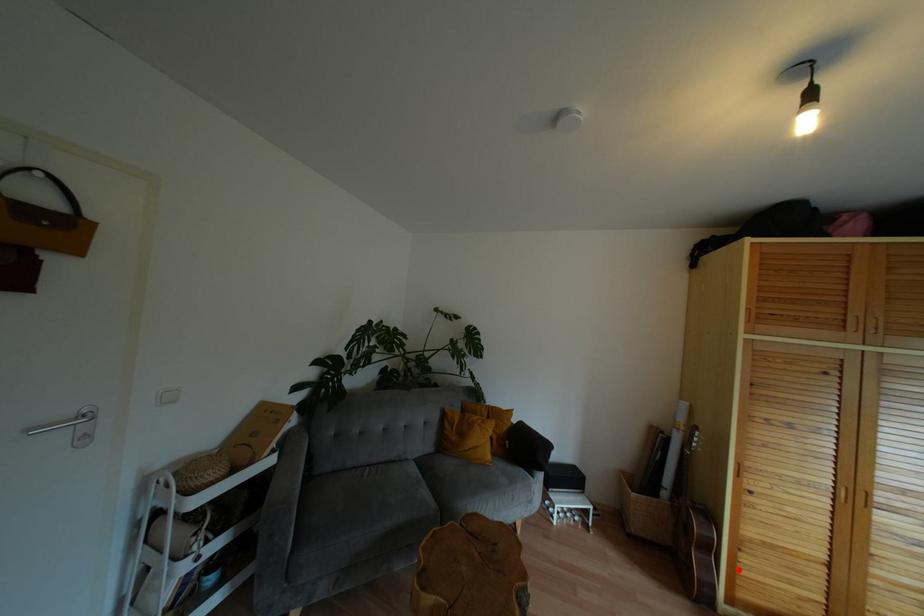
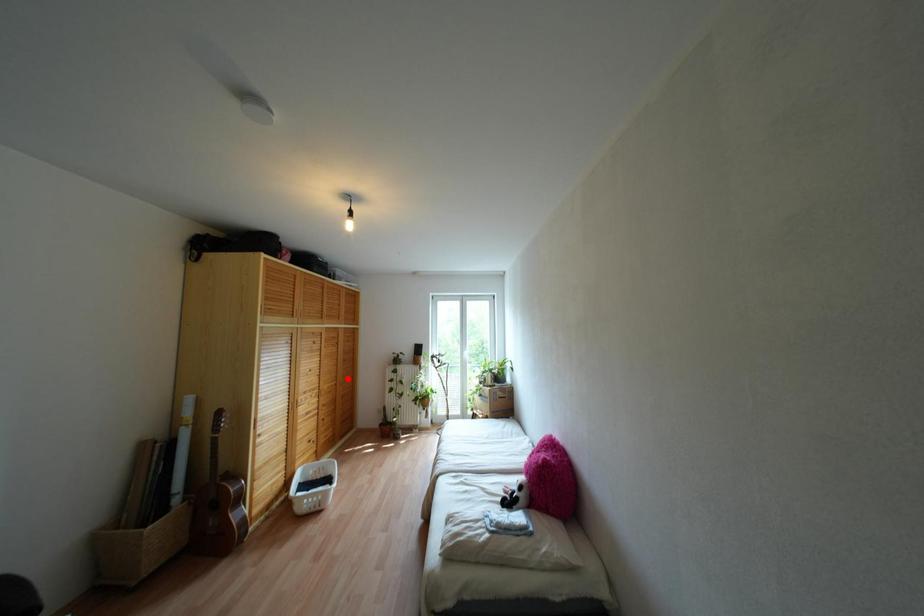
I am providing you with two images of the same scene from different viewpoints. A red point is marked on the first image and another point is marked on the second image. Is the marked point in image1 the same physical position as the marked point in image2?

No